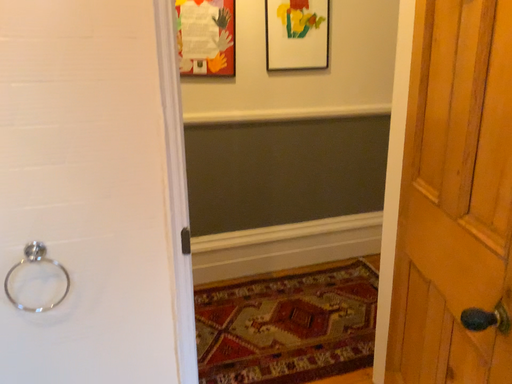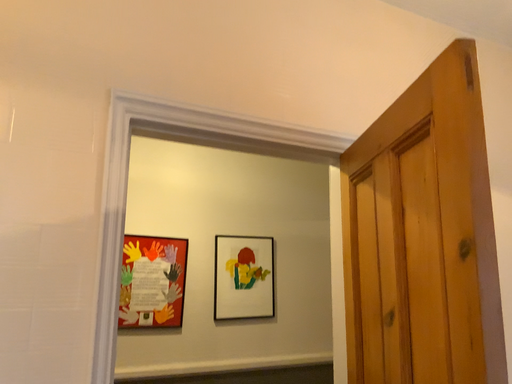
Question: Which way did the camera rotate in the video?

Choices:
 (A) rotated downward
 (B) rotated upward

Answer: (B)